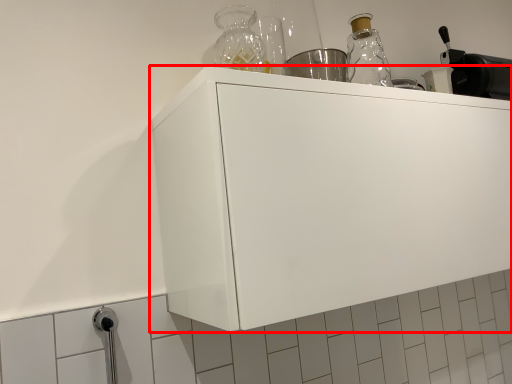
Question: From the image's perspective, where is cabinetry (annotated by the red box) located in relation to appliance in the image?

Choices:
 (A) above
 (B) below

Answer: (B)